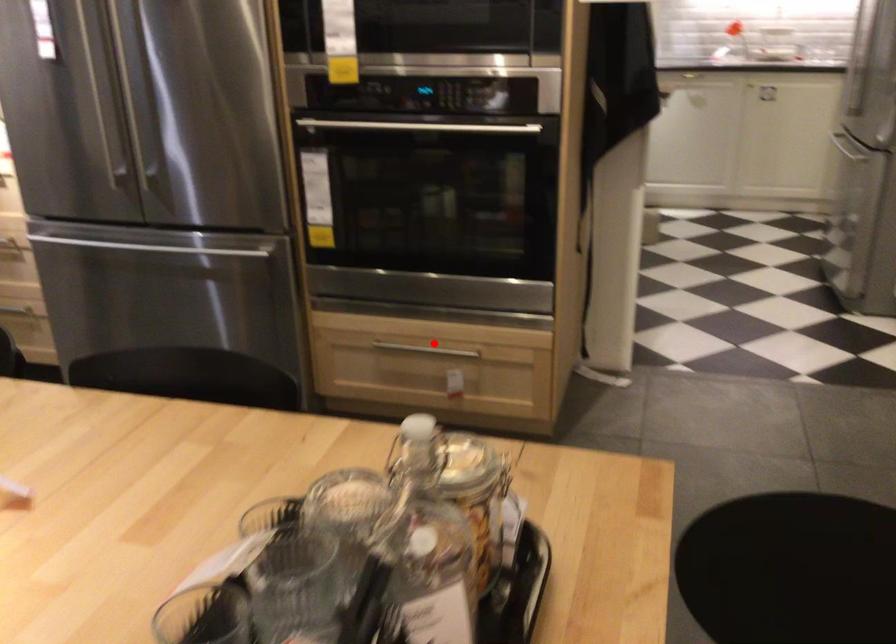
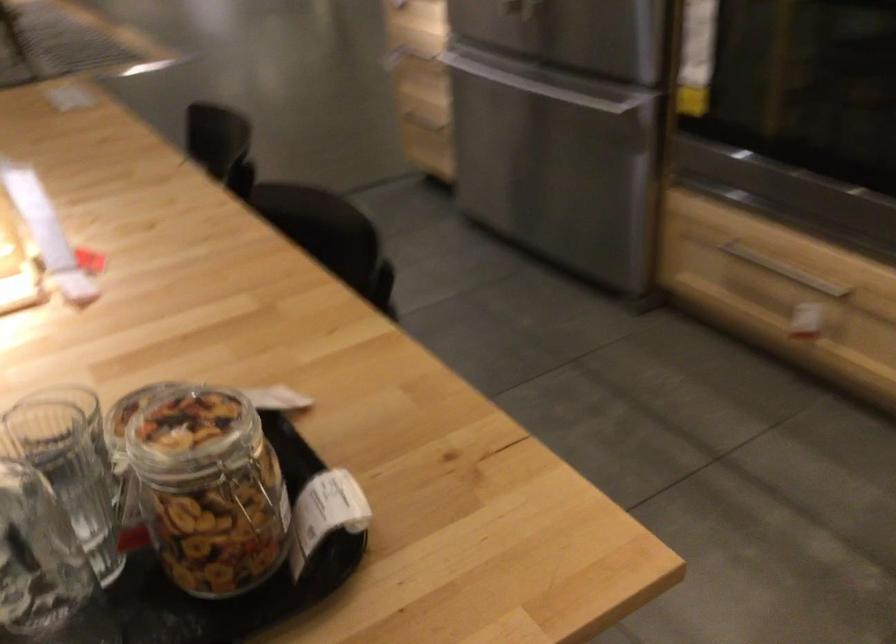
Question: A red point is marked in image1. In image2, is the corresponding 3D point closer to the camera or farther? Reply with the corresponding letter.

Choices:
 (A) The corresponding 3D point is closer.
 (B) The corresponding 3D point is farther.

Answer: (A)